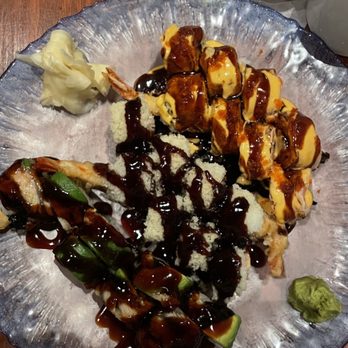
This screenshot has width=348, height=348. I want to click on top of wooden table, so click(31, 28).